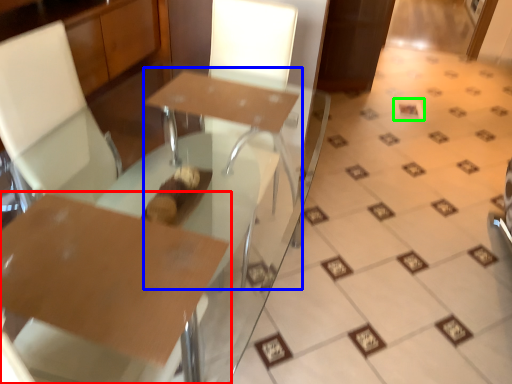
Question: Which object is positioned farthest from table (highlighted by a red box)? Select from round table (highlighted by a blue box) and square (highlighted by a green box).

Choices:
 (A) round table
 (B) square

Answer: (B)